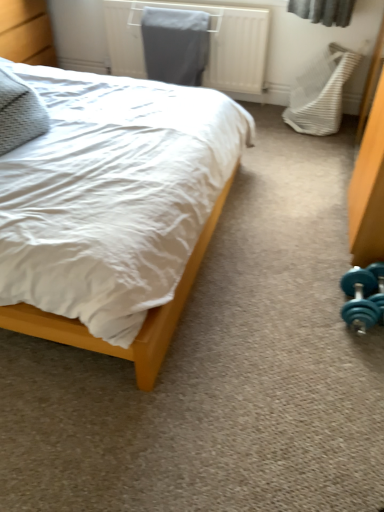
Where is `vacant space in front of teal rubber dumbbell at lower right`? This screenshot has height=512, width=384. vacant space in front of teal rubber dumbbell at lower right is located at coordinates click(x=347, y=361).